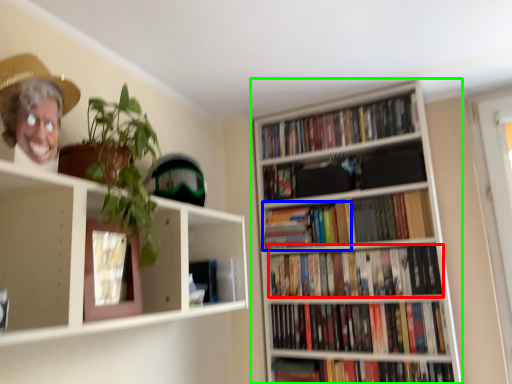
Question: Considering the real-world distances, which object is closest to book (highlighted by a red box)? book (highlighted by a blue box) or bookcase (highlighted by a green box).

Choices:
 (A) book
 (B) bookcase

Answer: (A)